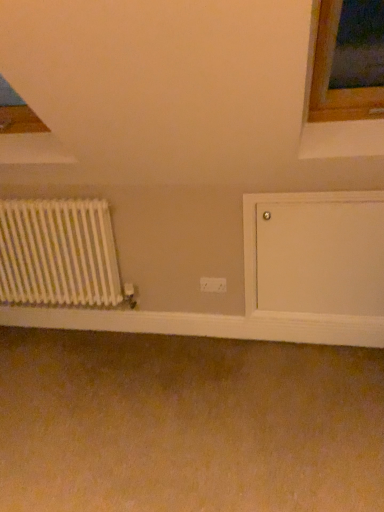
Question: Does white smooth wood at lower center have a greater height compared to white matte radiator at left?

Choices:
 (A) yes
 (B) no

Answer: (B)

Question: From the image's perspective, is white smooth wood at lower center above white matte radiator at left?

Choices:
 (A) no
 (B) yes

Answer: (A)

Question: Considering the relative positions of white smooth wood at lower center and white matte radiator at left in the image provided, is white smooth wood at lower center to the left of white matte radiator at left from the viewer's perspective?

Choices:
 (A) no
 (B) yes

Answer: (A)

Question: Is white smooth wood at lower center facing away from white matte radiator at left?

Choices:
 (A) no
 (B) yes

Answer: (A)

Question: Considering the relative sizes of white smooth wood at lower center and white matte radiator at left in the image provided, is white smooth wood at lower center bigger than white matte radiator at left?

Choices:
 (A) no
 (B) yes

Answer: (A)

Question: In the image, is white smooth wood at lower center on the left side or the right side of white matte radiator at left?

Choices:
 (A) right
 (B) left

Answer: (A)

Question: Considering their positions, is white smooth wood at lower center located in front of or behind white matte radiator at left?

Choices:
 (A) behind
 (B) front

Answer: (A)

Question: In terms of size, does white smooth wood at lower center appear bigger or smaller than white matte radiator at left?

Choices:
 (A) small
 (B) big

Answer: (A)

Question: From their relative heights in the image, would you say white smooth wood at lower center is taller or shorter than white matte radiator at left?

Choices:
 (A) tall
 (B) short

Answer: (B)

Question: Would you say white smooth wood at lower center is to the left or to the right of white plastic electric outlet at center in the picture?

Choices:
 (A) left
 (B) right

Answer: (A)

Question: Is white smooth wood at lower center wider or thinner than white plastic electric outlet at center?

Choices:
 (A) thin
 (B) wide

Answer: (B)

Question: Is white smooth wood at lower center taller or shorter than white plastic electric outlet at center?

Choices:
 (A) short
 (B) tall

Answer: (B)

Question: Is white smooth wood at lower center bigger or smaller than white plastic electric outlet at center?

Choices:
 (A) small
 (B) big

Answer: (B)

Question: In terms of width, does white plastic electric outlet at center look wider or thinner when compared to white matte radiator at left?

Choices:
 (A) thin
 (B) wide

Answer: (A)

Question: In terms of height, does white plastic electric outlet at center look taller or shorter compared to white matte radiator at left?

Choices:
 (A) tall
 (B) short

Answer: (B)